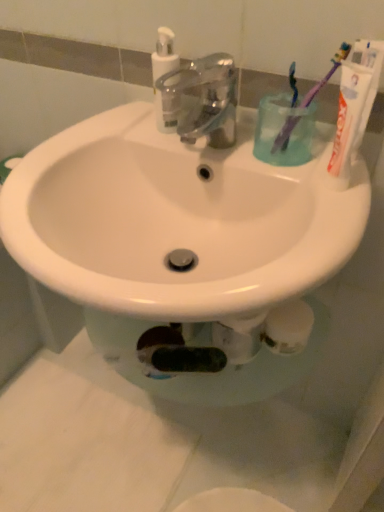
You are a GUI agent. You are given a task and a screenshot of the screen. Output one action in this format:
    pyautogui.click(x=<x>, y=<y>)
    Task: Click on the spots to the right of metallic faucet at center
    
    Given the screenshot: What is the action you would take?
    pyautogui.click(x=287, y=164)